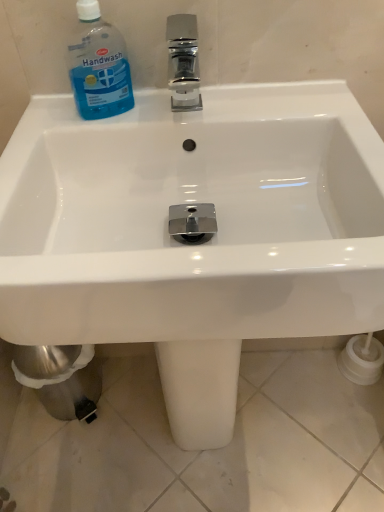
The image size is (384, 512). What are the coordinates of `translucent plastic handwash at upper left` in the screenshot? It's located at (98, 65).

What do you see at coordinates (98, 65) in the screenshot? I see `translucent plastic handwash at upper left` at bounding box center [98, 65].

Where is `translucent plastic handwash at upper left`? translucent plastic handwash at upper left is located at coordinates (98, 65).